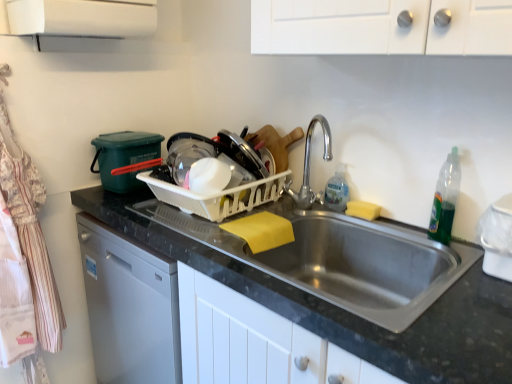
The width and height of the screenshot is (512, 384). I want to click on vacant region to the left of yellow sponge at sink right, so click(x=324, y=213).